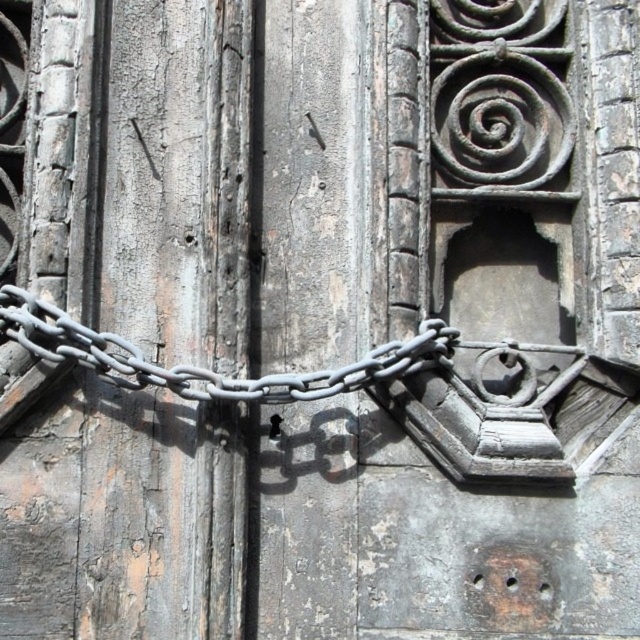
Question: Among these points, which one is farthest from the camera?

Choices:
 (A) (88, 332)
 (B) (273, 435)

Answer: (B)

Question: Is gray metallic chain at center positioned at the back of black matte padlock at center?

Choices:
 (A) no
 (B) yes

Answer: (A)

Question: Considering the relative positions of gray metallic chain at center and black matte padlock at center in the image provided, where is gray metallic chain at center located with respect to black matte padlock at center?

Choices:
 (A) above
 (B) below

Answer: (A)

Question: Which of the following is the farthest from the observer?

Choices:
 (A) black matte padlock at center
 (B) gray metallic chain at center

Answer: (A)

Question: Can you confirm if gray metallic chain at center is positioned above black matte padlock at center?

Choices:
 (A) no
 (B) yes

Answer: (B)